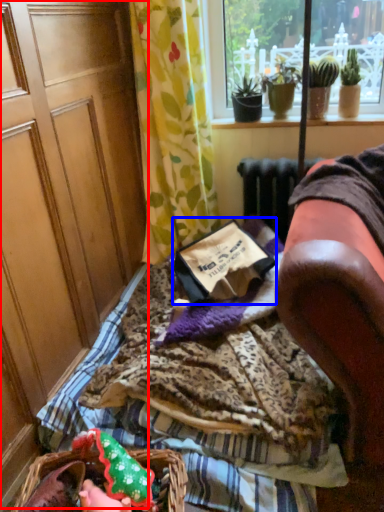
Question: Among these objects, which one is nearest to the camera, screen door (highlighted by a red box) or paperback book (highlighted by a blue box)?

Choices:
 (A) screen door
 (B) paperback book

Answer: (A)